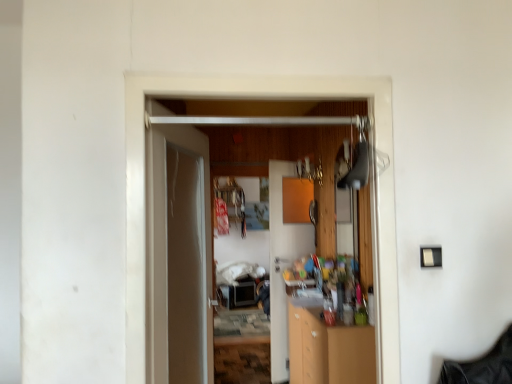
Question: Which direction should I rotate to look at wooden cabinet at center, which appears as the first door when viewed from the back?

Choices:
 (A) right
 (B) left

Answer: (A)

Question: Can you confirm if wooden cabinet at center, which appears as the first door when viewed from the back, is bigger than white glossy door at center, the second door in the front-to-back sequence?

Choices:
 (A) no
 (B) yes

Answer: (A)

Question: Is white glossy door at center, the second door in the front-to-back sequence, completely or partially inside wooden cabinet at center, the 3th door from the front?

Choices:
 (A) yes
 (B) no

Answer: (B)

Question: Is wooden cabinet at center, the 3th door from the front, oriented towards white glossy door at center, which ranks as the second door in back-to-front order?

Choices:
 (A) no
 (B) yes

Answer: (A)

Question: From the image's perspective, would you say wooden cabinet at center, which appears as the first door when viewed from the back, is shown under white glossy door at center, the second door in the front-to-back sequence?

Choices:
 (A) no
 (B) yes

Answer: (B)

Question: Considering the relative sizes of wooden cabinet at center, which appears as the first door when viewed from the back, and white glossy door at center, the second door in the front-to-back sequence, in the image provided, is wooden cabinet at center, which appears as the first door when viewed from the back, wider than white glossy door at center, the second door in the front-to-back sequence,?

Choices:
 (A) yes
 (B) no

Answer: (B)

Question: From the image's perspective, is wooden cabinet at center, which appears as the first door when viewed from the back, above white glossy door at center, which ranks as the second door in back-to-front order?

Choices:
 (A) yes
 (B) no

Answer: (B)

Question: Considering the relative sizes of wooden door at center, marked as the 3th door in a back-to-front arrangement, and wooden cabinet at center, which appears as the first door when viewed from the back, in the image provided, is wooden door at center, marked as the 3th door in a back-to-front arrangement, thinner than wooden cabinet at center, which appears as the first door when viewed from the back,?

Choices:
 (A) no
 (B) yes

Answer: (B)

Question: Is wooden door at center, arranged as the 1th door when viewed from the front, bigger than wooden cabinet at center, the 3th door from the front?

Choices:
 (A) no
 (B) yes

Answer: (A)

Question: From the image's perspective, is wooden door at center, arranged as the 1th door when viewed from the front, under wooden cabinet at center, which appears as the first door when viewed from the back?

Choices:
 (A) no
 (B) yes

Answer: (A)

Question: From the image's perspective, does wooden door at center, arranged as the 1th door when viewed from the front, appear higher than wooden cabinet at center, the 3th door from the front?

Choices:
 (A) no
 (B) yes

Answer: (B)

Question: From a real-world perspective, does wooden door at center, arranged as the 1th door when viewed from the front, stand above wooden cabinet at center, which appears as the first door when viewed from the back?

Choices:
 (A) no
 (B) yes

Answer: (B)

Question: Is wooden door at center, arranged as the 1th door when viewed from the front, shorter than wooden cabinet at center, which appears as the first door when viewed from the back?

Choices:
 (A) yes
 (B) no

Answer: (A)

Question: From a real-world perspective, is wooden door at center, arranged as the 1th door when viewed from the front, physically above white glossy door at center, which ranks as the second door in back-to-front order?

Choices:
 (A) no
 (B) yes

Answer: (B)